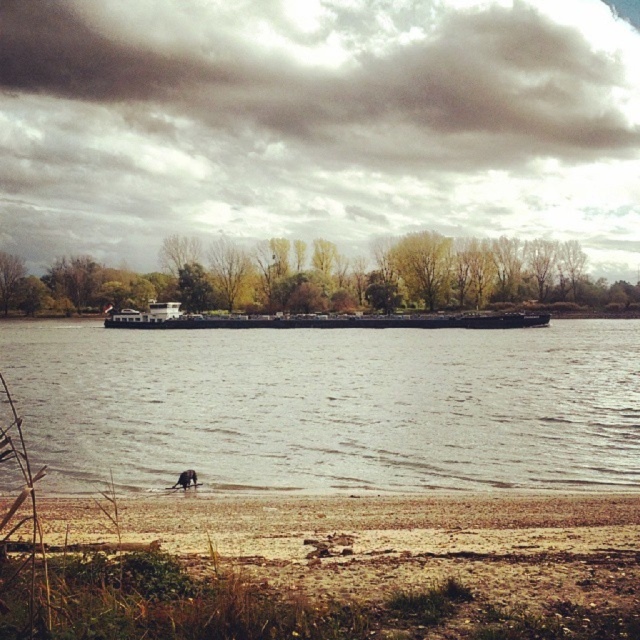
You are a photographer trying to capture the entire gray metallic barge at center and brown sand at lower center in one frame. Based on their sizes, is it possible to fit both objects in the camera view without zooming in?

The gray metallic barge at center might be wider than brown sand at lower center, so it depends on the camera view. If the barge is wider, it might block part of the sand, making it harder to capture both fully.

You are navigating a small boat on the river and want to reach the point at coordinates point at (52, 417) from your current position at point at (400, 632). Considering the spatial relationship between these two points, which direction should you steer your boat to move towards the desired point?

Since point at (52, 417) is behind point at (400, 632), you should steer your boat in the direction opposite to where point at (400, 632) is located to reach point at (52, 417).